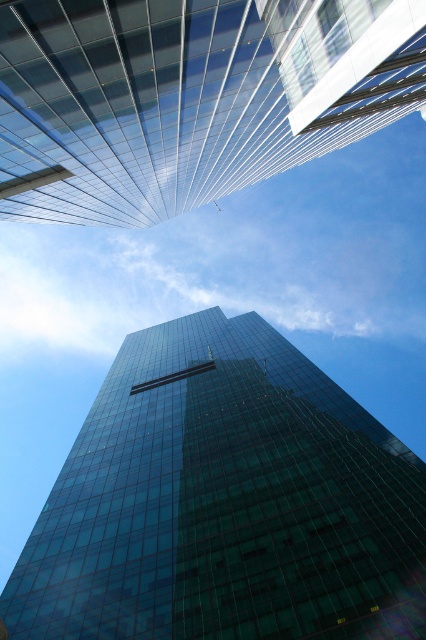
Which is behind, point (414, 632) or point (255, 157)?

The point (255, 157) is more distant.

Where is `transparent glass tower at center`? transparent glass tower at center is located at coordinates click(x=224, y=502).